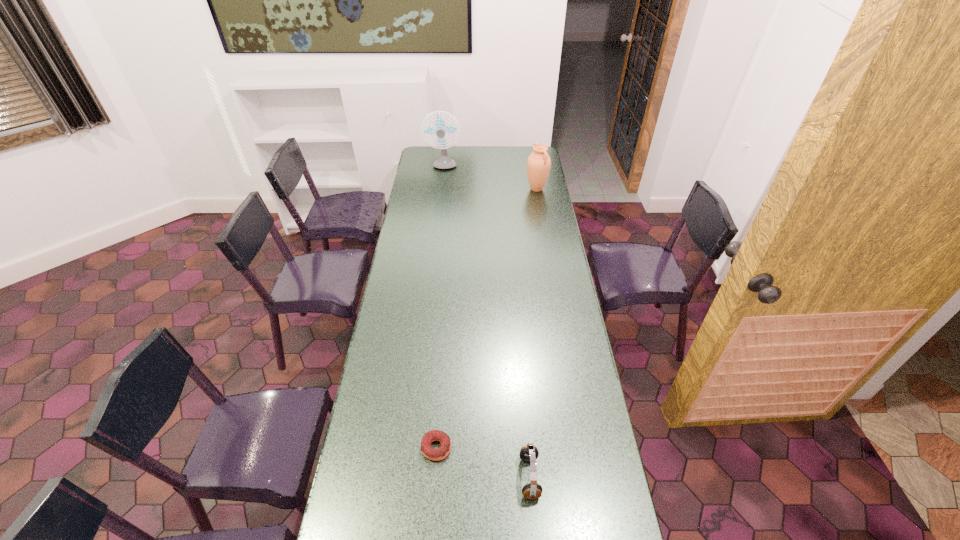
Where is `the farthest object`? The image size is (960, 540). the farthest object is located at coordinates (444, 162).

This screenshot has width=960, height=540. In order to click on the tallest object in this screenshot , I will do `click(444, 162)`.

In order to click on the rightmost object in this screenshot , I will do `click(538, 164)`.

Find the location of a particular element. the third shortest object is located at coordinates (538, 164).

Locate an element on the screen. the third tallest object is located at coordinates (529, 453).

I want to click on headset, so click(529, 453).

I want to click on the shortest object, so (x=433, y=454).

This screenshot has height=540, width=960. What are the coordinates of `free space located 0.370m on the front-facing side of the farthest object` in the screenshot? It's located at (439, 211).

This screenshot has height=540, width=960. I want to click on vacant area located on the front of the second farthest object, so click(x=540, y=212).

The image size is (960, 540). In order to click on vacant space located 0.100m on the ear cups of the headset in this screenshot , I will do click(x=486, y=477).